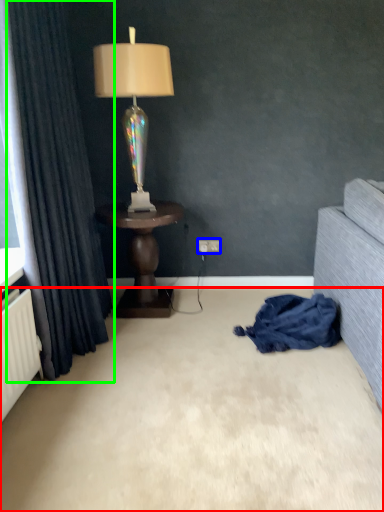
Question: Estimate the real-world distances between objects in this image. Which object is farther from plain (highlighted by a red box), electric outlet (highlighted by a blue box) or curtain (highlighted by a green box)?

Choices:
 (A) electric outlet
 (B) curtain

Answer: (A)